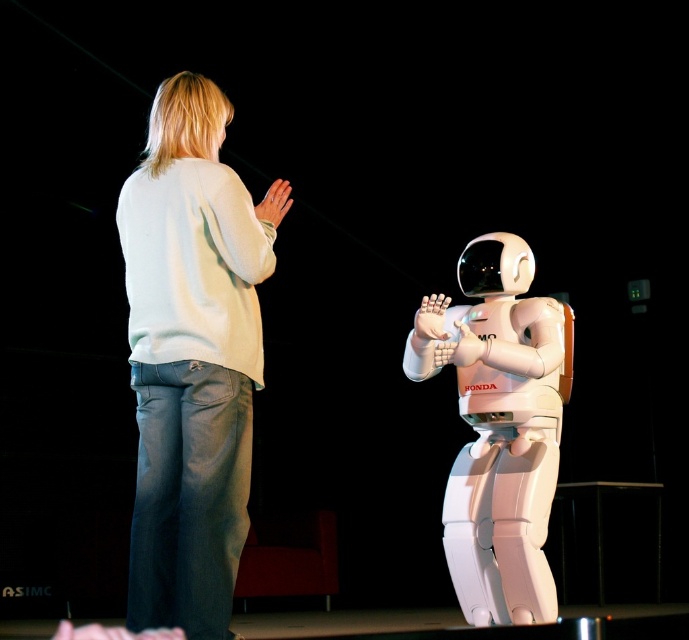
You are an astronaut preparing for a spacewalk. You see a white cotton sweater at upper left and a white matte astronaut at center. Which item is more suitable to wear for the spacewalk?

The white matte astronaut at center is more suitable to wear for the spacewalk because it is larger than the white cotton sweater at upper left.

Where is the white cotton sweater at upper left located in the image?

The white cotton sweater at upper left is located at point (x=192, y=356).